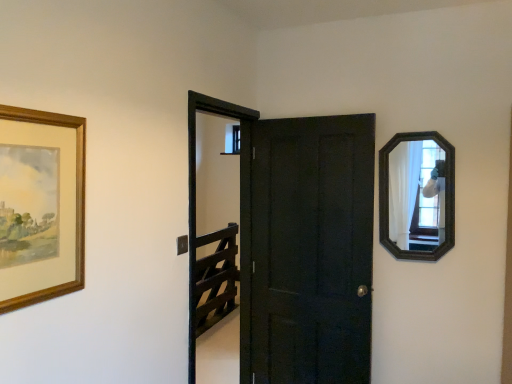
Question: Can you confirm if matte black door at center is shorter than wooden-framed mirror at upper right?

Choices:
 (A) no
 (B) yes

Answer: (A)

Question: Is matte black door at center positioned beyond the bounds of wooden-framed mirror at upper right?

Choices:
 (A) no
 (B) yes

Answer: (B)

Question: Can you confirm if matte black door at center is bigger than wooden-framed mirror at upper right?

Choices:
 (A) yes
 (B) no

Answer: (A)

Question: Does matte black door at center have a smaller size compared to wooden-framed mirror at upper right?

Choices:
 (A) yes
 (B) no

Answer: (B)

Question: Is matte black door at center next to wooden-framed mirror at upper right?

Choices:
 (A) yes
 (B) no

Answer: (B)

Question: Does matte black door at center lie in front of wooden-framed mirror at upper right?

Choices:
 (A) yes
 (B) no

Answer: (B)

Question: Is matte black door at center outside of wooden picture frame at left?

Choices:
 (A) no
 (B) yes

Answer: (B)

Question: From a real-world perspective, is matte black door at center under wooden picture frame at left?

Choices:
 (A) no
 (B) yes

Answer: (B)

Question: Would you say matte black door at center is a long distance from wooden picture frame at left?

Choices:
 (A) yes
 (B) no

Answer: (A)

Question: Is matte black door at center beside wooden picture frame at left?

Choices:
 (A) yes
 (B) no

Answer: (B)

Question: From a real-world perspective, is matte black door at center over wooden picture frame at left?

Choices:
 (A) no
 (B) yes

Answer: (A)

Question: Can you confirm if matte black door at center is smaller than wooden picture frame at left?

Choices:
 (A) no
 (B) yes

Answer: (A)

Question: Can you confirm if wooden picture frame at left is wider than black wooden screen door at center?

Choices:
 (A) yes
 (B) no

Answer: (B)